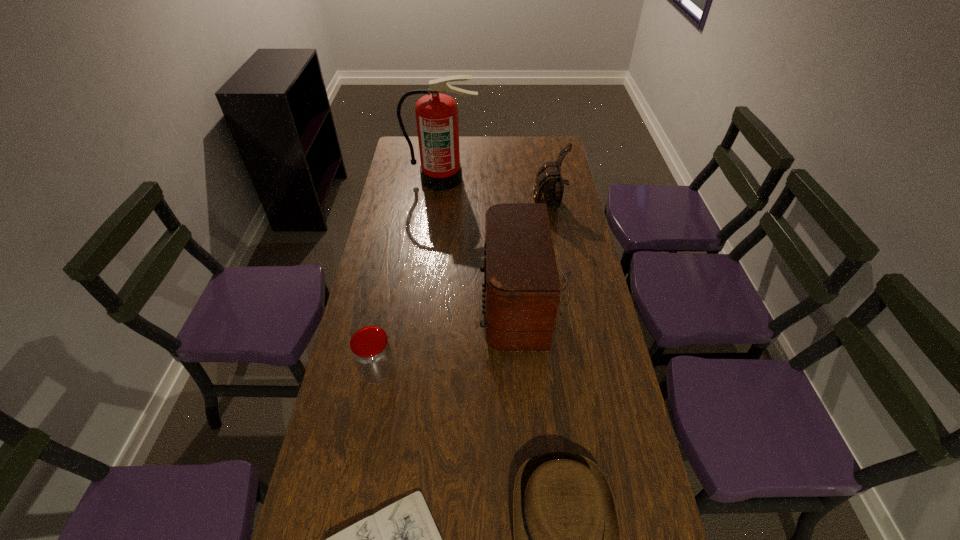
Identify the location of the tallest object. (436, 114).

Where is `fire extinguisher`? fire extinguisher is located at coordinates (436, 114).

Locate an element on the screen. the fifth shortest object is located at coordinates (521, 293).

You are a GUI agent. You are given a task and a screenshot of the screen. Output one action in this format:
    pyautogui.click(x=<x>, y=<y>)
    Task: Click on the third tallest object
    
    Given the screenshot: What is the action you would take?
    pyautogui.click(x=549, y=185)

I want to click on shoulder bag, so click(x=549, y=185).

Locate an element on the screen. The image size is (960, 540). jar is located at coordinates coord(371,351).

Where is `free spot located at the nozzle of the farthest object`? free spot located at the nozzle of the farthest object is located at coordinates (440, 202).

You are a GUI agent. You are given a task and a screenshot of the screen. Output one action in this format:
    pyautogui.click(x=<x>, y=<y>)
    Task: Click on the vacant space located 0.290m on the front panel of the fifth shortest object
    This screenshot has height=540, width=960.
    Given the screenshot: What is the action you would take?
    pyautogui.click(x=390, y=309)

Where is `vacant space located on the front panel of the fifth shortest object`? vacant space located on the front panel of the fifth shortest object is located at coordinates (396, 309).

Where is `free space located 0.350m on the front panel of the fifth shortest object`? free space located 0.350m on the front panel of the fifth shortest object is located at coordinates (372, 309).